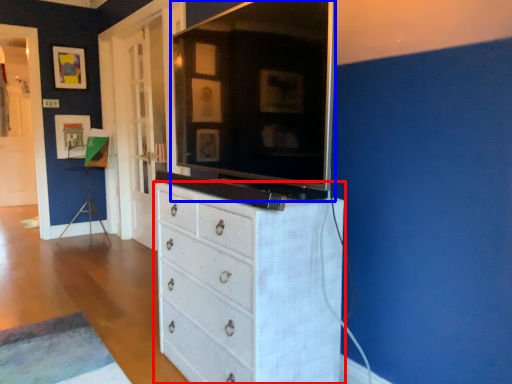
Question: Which object is closer to the camera taking this photo, chest of drawers (highlighted by a red box) or tv cabinet (highlighted by a blue box)?

Choices:
 (A) chest of drawers
 (B) tv cabinet

Answer: (B)